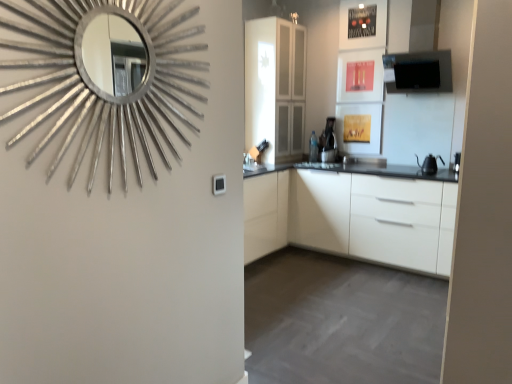
This screenshot has height=384, width=512. I want to click on vacant space situated above white glossy sink at center (from a real-world perspective), so click(256, 138).